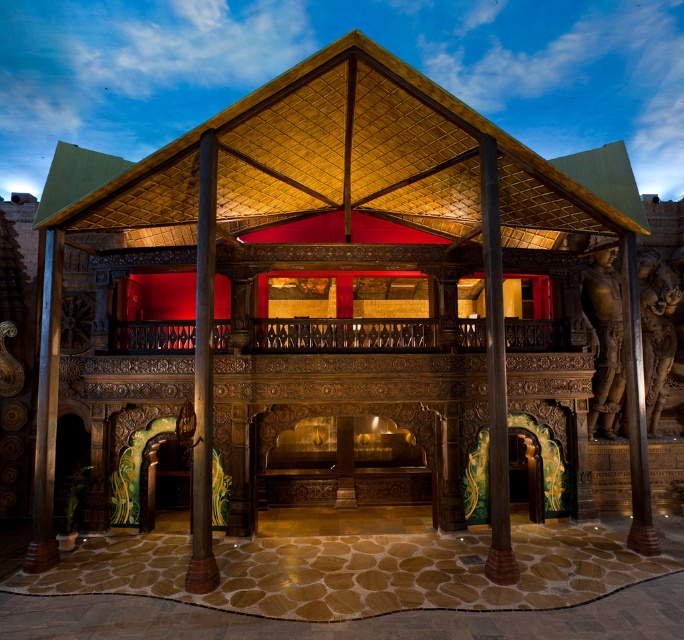
Question: Among these points, which one is nearest to the camera?

Choices:
 (A) (499, 493)
 (B) (200, 228)
 (C) (308, 330)

Answer: (A)

Question: Which point is farther to the camera?

Choices:
 (A) gold textured canopy at center
 (B) wooden pillar at center
 (C) brown polished wood pillar at center

Answer: (B)

Question: Among these points, which one is farthest from the camera?

Choices:
 (A) (209, 227)
 (B) (131, 330)
 (C) (395, 216)

Answer: (C)

Question: Is wooden railing at center bigger than brown polished wood pillar at center?

Choices:
 (A) no
 (B) yes

Answer: (B)

Question: Does gold textured canopy at center appear on the left side of wooden railing at center?

Choices:
 (A) no
 (B) yes

Answer: (A)

Question: Can you confirm if brown polished wood statue at right is positioned above brown polished wood pillar at center?

Choices:
 (A) no
 (B) yes

Answer: (A)